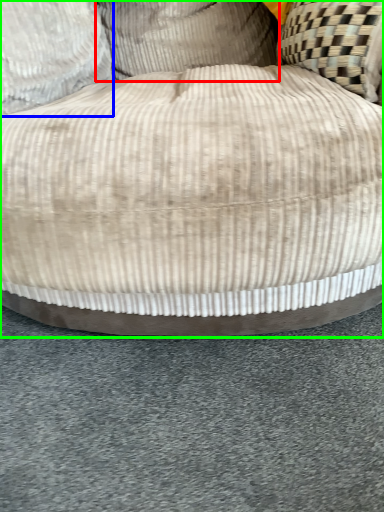
Question: Which object is the farthest from pillow (highlighted by a red box)? Choose among these: pillow (highlighted by a blue box) or furniture (highlighted by a green box).

Choices:
 (A) pillow
 (B) furniture

Answer: (B)